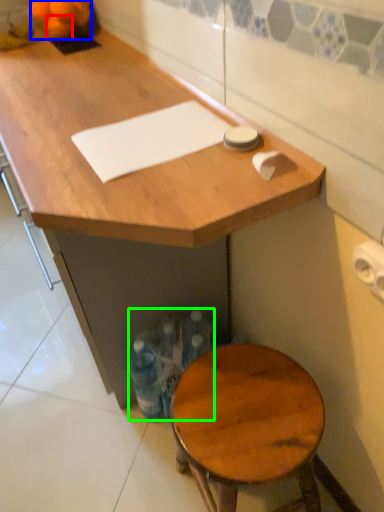
Question: Considering the real-world distances, which object is closest to tangerine (highlighted by a red box)? tangerine (highlighted by a blue box) or bottle (highlighted by a green box).

Choices:
 (A) tangerine
 (B) bottle

Answer: (A)